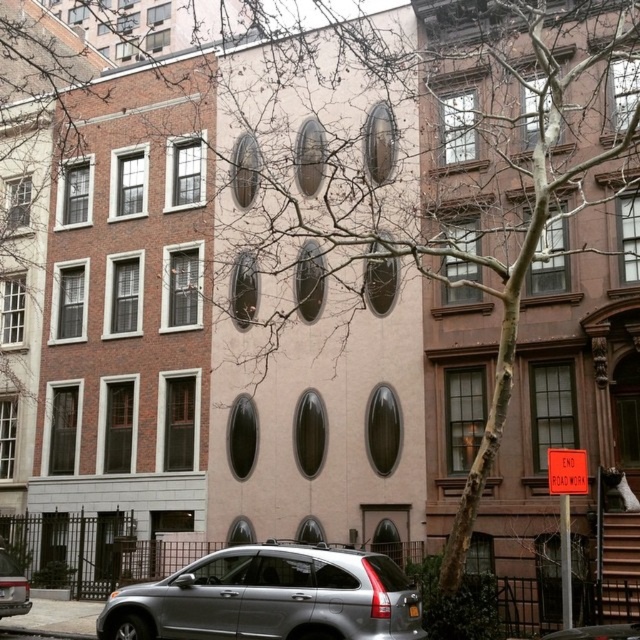
You are standing at the entrance of the central building and want to park your satin silver suv at lower center. Given the coordinates provided, can you determine if the parking spot is directly in front of the central building?

The satin silver suv at lower center is located at point (269, 596), which means it is positioned at the lower center area of the image. Since the central building is in the middle of the scene, the parking spot is directly in front of it.

You are a delivery driver trying to park your silver metallic suv at lower left. You need to know if there is space between the satin silver suv at lower center and the building to the left. Can you park there?

The satin silver suv at lower center is located above the silver metallic suv at lower left, meaning there is space between them. Therefore, you can park your silver metallic suv at lower left in that space.